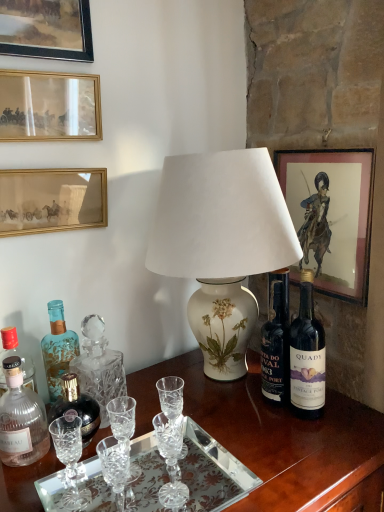
Find the location of a particular element. This screenshot has width=384, height=512. spots to the right of translucent glass bottle at left, the third bottle viewed from the back is located at coordinates (107, 448).